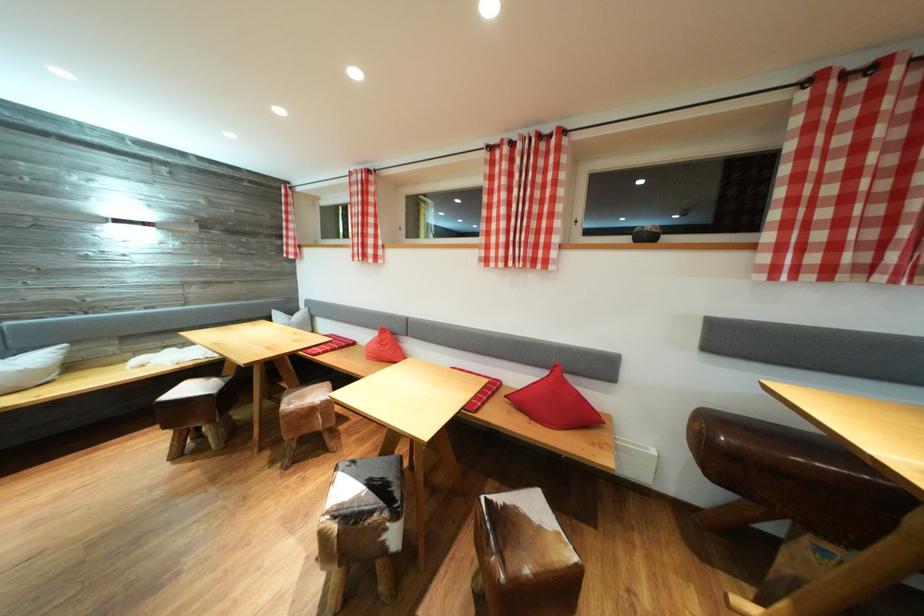
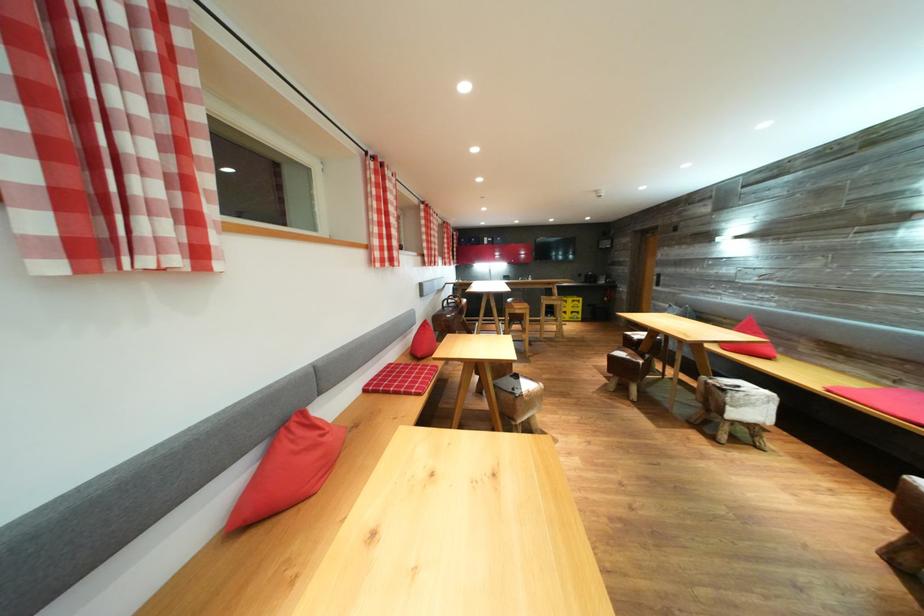
Question: I am providing you with two images of the same scene from different viewpoints. After the viewpoint changes to image2, which objects are now occluded?

Choices:
 (A) blue button
 (B) pommel horse seat
 (C) pink seat cushion
 (D) brown leather stool

Answer: (B)